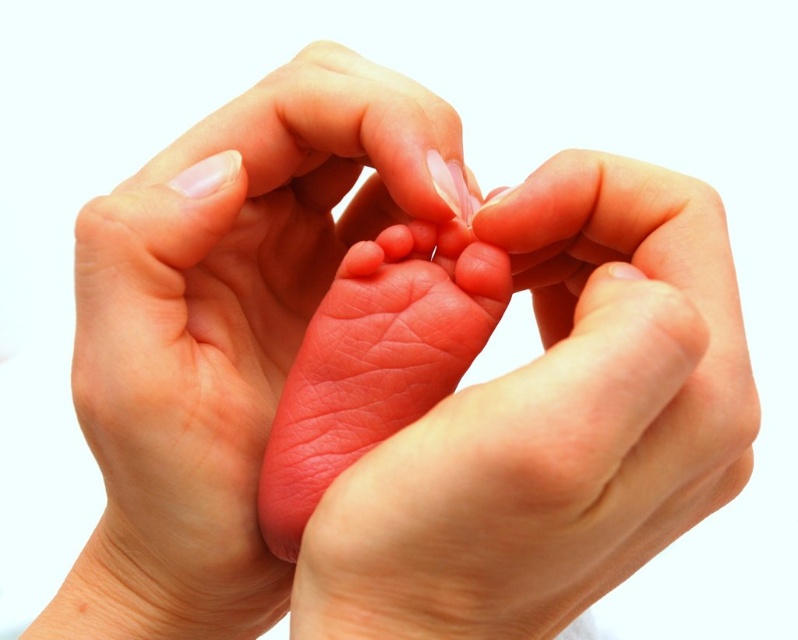
Question: Does smooth pink toe at center appear over pink soft skin at center?

Choices:
 (A) yes
 (B) no

Answer: (A)

Question: Which point is farther to the camera?

Choices:
 (A) (133, 465)
 (B) (477, 257)
 (C) (567, 369)

Answer: (B)

Question: Is pink smooth toe at center below pink soft skin at center?

Choices:
 (A) no
 (B) yes

Answer: (A)

Question: Among these points, which one is nearest to the camera?

Choices:
 (A) (745, 435)
 (B) (85, 637)
 (C) (399, 227)
 (D) (451, 276)

Answer: (A)

Question: Based on their relative distances, which object is farther from the smooth flesh toe at center?

Choices:
 (A) glossy pink nail at center
 (B) smooth skin baby foot at center
 (C) pink soft skin at center
 (D) pink smooth foot at center

Answer: (D)

Question: Does glossy pink nail at center appear on the left side of smooth pink toe at center?

Choices:
 (A) no
 (B) yes

Answer: (B)